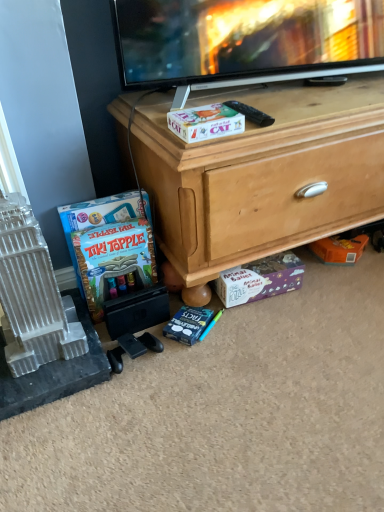
I want to click on vacant space to the right of black plastic remote control at upper center, so click(x=307, y=110).